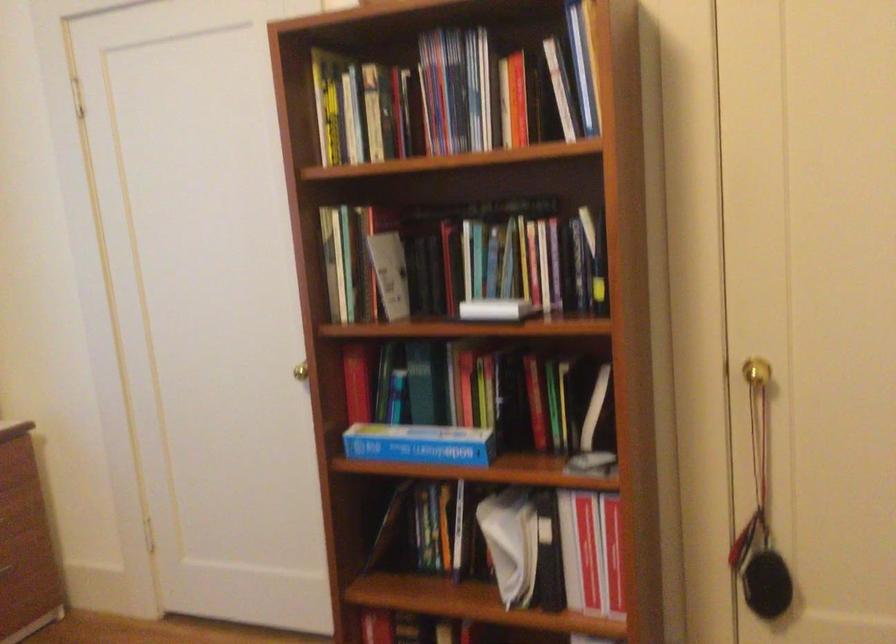
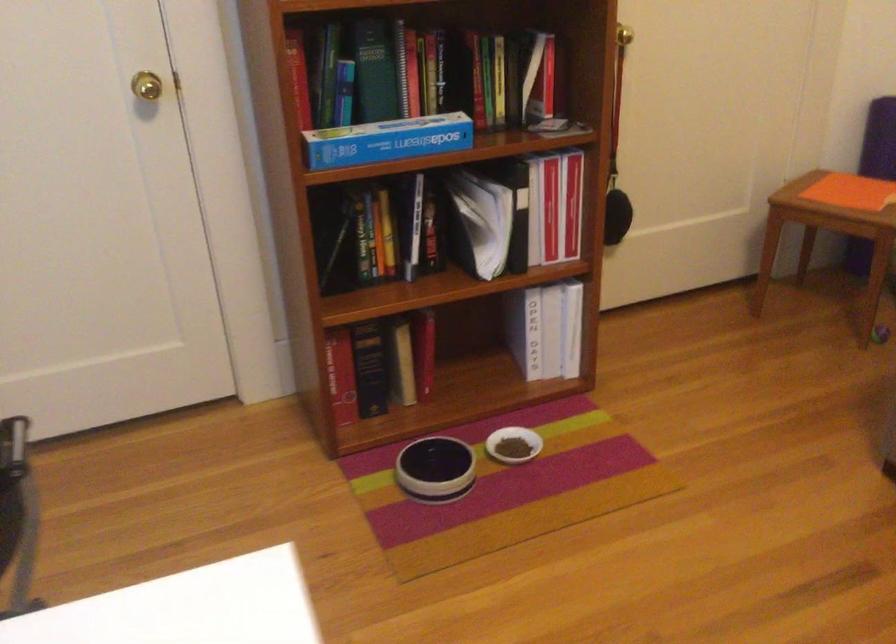
In the second image, find the point that corresponds to [290,370] in the first image.

(147, 86)